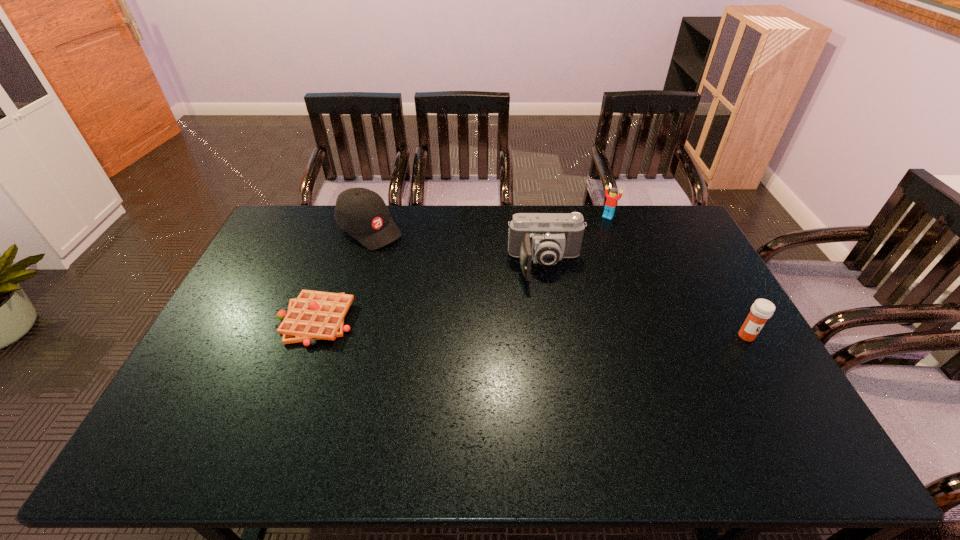
Find the location of a particular element. The height and width of the screenshot is (540, 960). free location at the near edge of the desktop is located at coordinates (x=390, y=418).

Identify the location of vacant space at the left edge of the desktop. The width and height of the screenshot is (960, 540). (268, 298).

Identify the location of vacant space at the right edge. This screenshot has width=960, height=540. (733, 322).

Image resolution: width=960 pixels, height=540 pixels. I want to click on free area in between the camera and the baseball cap, so click(x=458, y=247).

Locate an element on the screen. Image resolution: width=960 pixels, height=540 pixels. vacant space in between the third object from left to right and the shortest object is located at coordinates (431, 293).

I want to click on free spot between the baseball cap and the Lego, so click(489, 223).

Where is `empty space that is in between the waffle and the medicine`? empty space that is in between the waffle and the medicine is located at coordinates (531, 328).

Identify the location of free space between the Lego and the waffle. (462, 269).

This screenshot has width=960, height=540. What are the coordinates of `free space between the camera and the shortest object` in the screenshot? It's located at (431, 293).

The image size is (960, 540). I want to click on free space that is in between the baseball cap and the medicine, so click(558, 282).